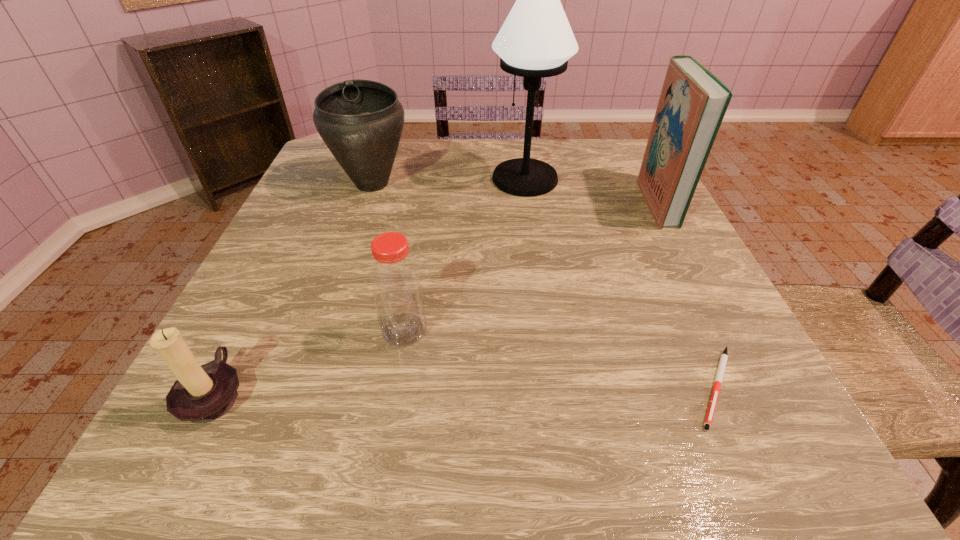
Where is `vacant area situated 0.170m on the cover of the fifth shortest object`? Image resolution: width=960 pixels, height=540 pixels. vacant area situated 0.170m on the cover of the fifth shortest object is located at coordinates (573, 202).

The height and width of the screenshot is (540, 960). I want to click on vacant space located on the back of the urn, so click(x=386, y=143).

Image resolution: width=960 pixels, height=540 pixels. I want to click on free space located on the back of the third shortest object, so click(418, 245).

The height and width of the screenshot is (540, 960). What are the coordinates of `blank space located on the wick of the candle holder` in the screenshot? It's located at (313, 393).

Find the location of a particular element. This screenshot has width=960, height=540. table lamp that is positioned at the far edge is located at coordinates (536, 40).

At what (x,y) coordinates should I click in order to perform the action: click on hardback book that is positioned at the far edge. Please return your answer as a coordinate pair (x, y). This screenshot has height=540, width=960. Looking at the image, I should click on (693, 102).

The image size is (960, 540). Find the location of `urn that is at the far edge`. urn that is at the far edge is located at coordinates (361, 121).

Locate an element on the screen. The width and height of the screenshot is (960, 540). candle holder at the near edge is located at coordinates (201, 394).

Image resolution: width=960 pixels, height=540 pixels. I want to click on pen at the near edge, so click(x=723, y=360).

The height and width of the screenshot is (540, 960). In order to click on urn that is positioned at the left edge in this screenshot , I will do `click(361, 121)`.